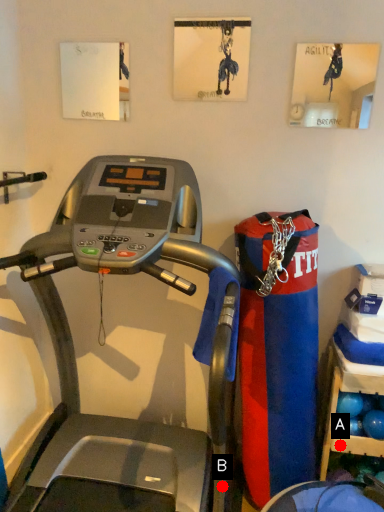
Question: Two points are circled on the image, labeled by A and B beside each circle. Among these points, which one is farthest from the camera?

Choices:
 (A) A is further
 (B) B is further

Answer: (A)